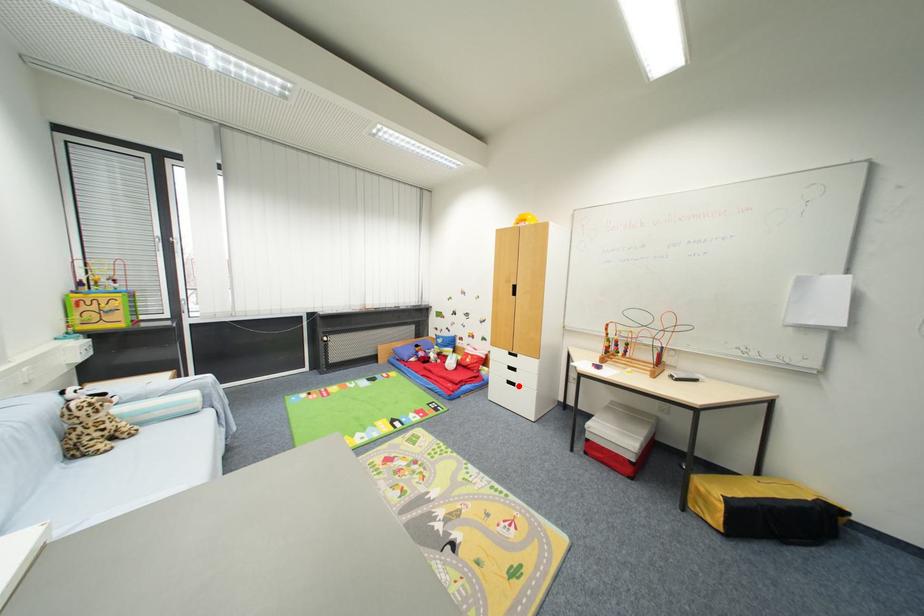
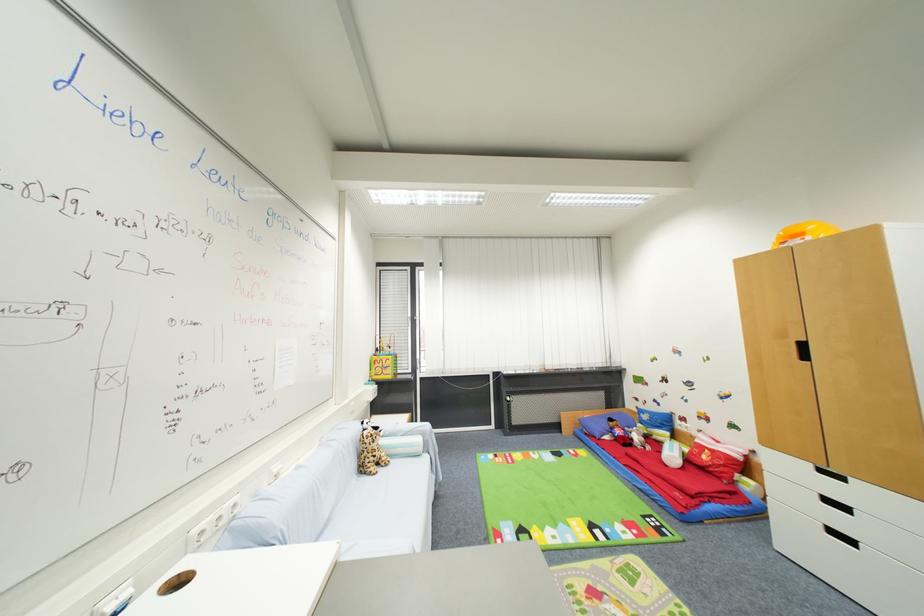
Question: I am providing you with two images of the same scene from different viewpoints. Image1 has a red point marked. In image2, the corresponding 3D location appears at what relative position? Reply with the corresponding letter.

Choices:
 (A) Closer
 (B) Farther

Answer: (A)